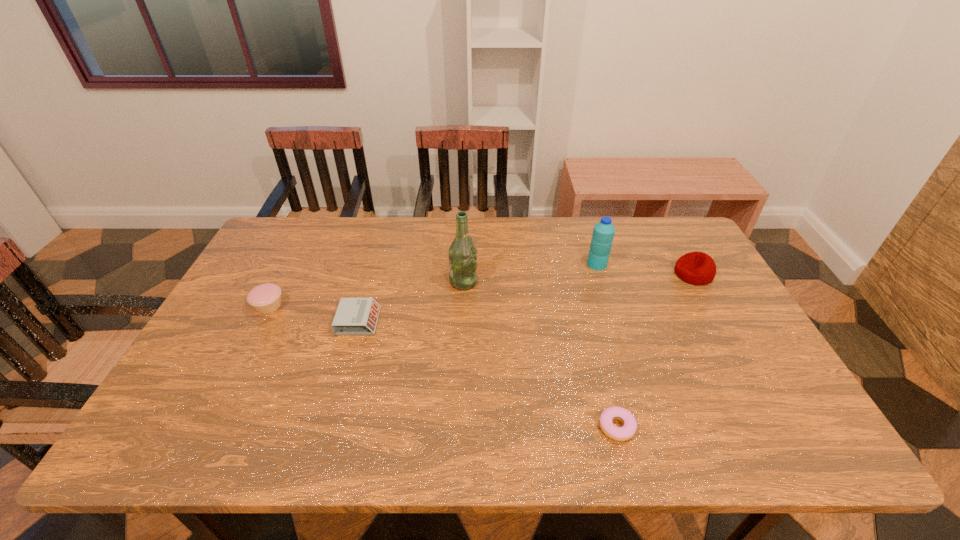
Locate an element on the screen. vacant area in the image that satisfies the following two spatial constraints: 1. on the seat area of the rightmost object; 2. on the front side of the alarm clock is located at coordinates (720, 321).

Locate an element on the screen. The width and height of the screenshot is (960, 540). free region that satisfies the following two spatial constraints: 1. on the front side of the third shortest object; 2. on the right side of the shortest object is located at coordinates (207, 427).

Find the location of `free location that satisfies the following two spatial constraints: 1. on the back side of the water bottle; 2. on the right side of the shortest object`. free location that satisfies the following two spatial constraints: 1. on the back side of the water bottle; 2. on the right side of the shortest object is located at coordinates (575, 264).